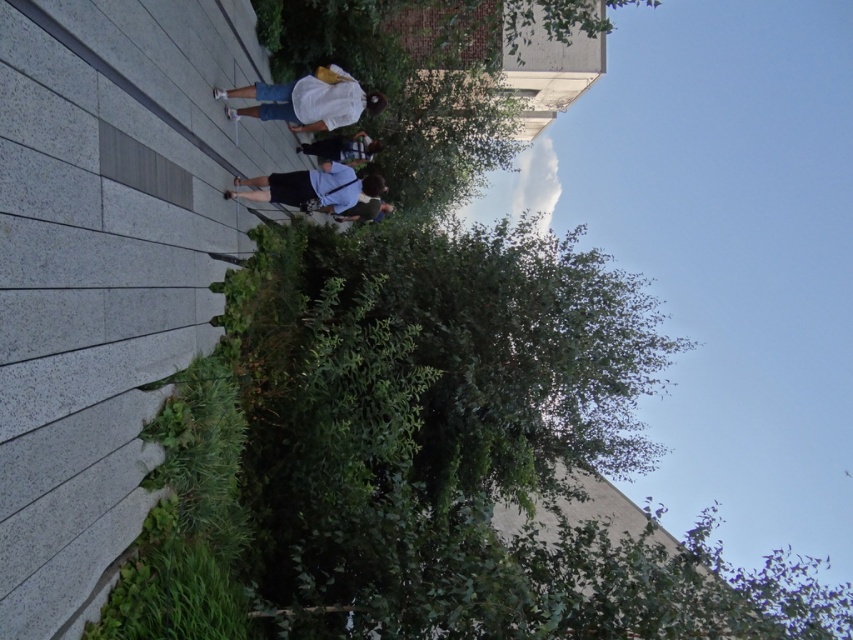
Question: Can you confirm if white cotton shirt at center is smaller than light blue shirt at center?

Choices:
 (A) no
 (B) yes

Answer: (A)

Question: Based on their relative distances, which object is nearer to the blue denim shorts at center?

Choices:
 (A) light blue shirt at center
 (B) dark blue jeans at center

Answer: (B)

Question: Observing the image, what is the correct spatial positioning of white cotton shirt at center in reference to blue denim shorts at center?

Choices:
 (A) left
 (B) right

Answer: (A)

Question: Is light blue shirt at center closer to the viewer compared to blue denim shorts at center?

Choices:
 (A) yes
 (B) no

Answer: (A)

Question: Which is farther from the dark blue jeans at center?

Choices:
 (A) blue denim shorts at center
 (B) light blue shirt at center
 (C) white cotton shirt at center

Answer: (B)

Question: Which is farther from the light blue shirt at center?

Choices:
 (A) white cotton shirt at center
 (B) dark blue jeans at center

Answer: (B)